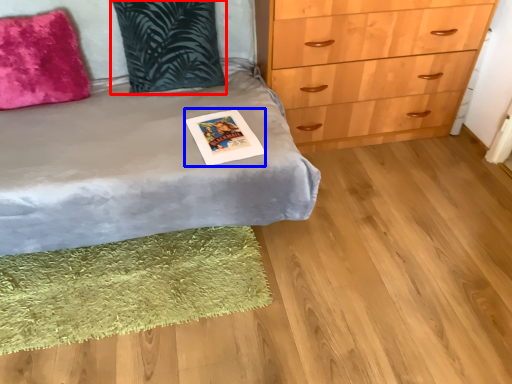
Question: Which object is further to the camera taking this photo, pillow (highlighted by a red box) or postcard (highlighted by a blue box)?

Choices:
 (A) pillow
 (B) postcard

Answer: (A)